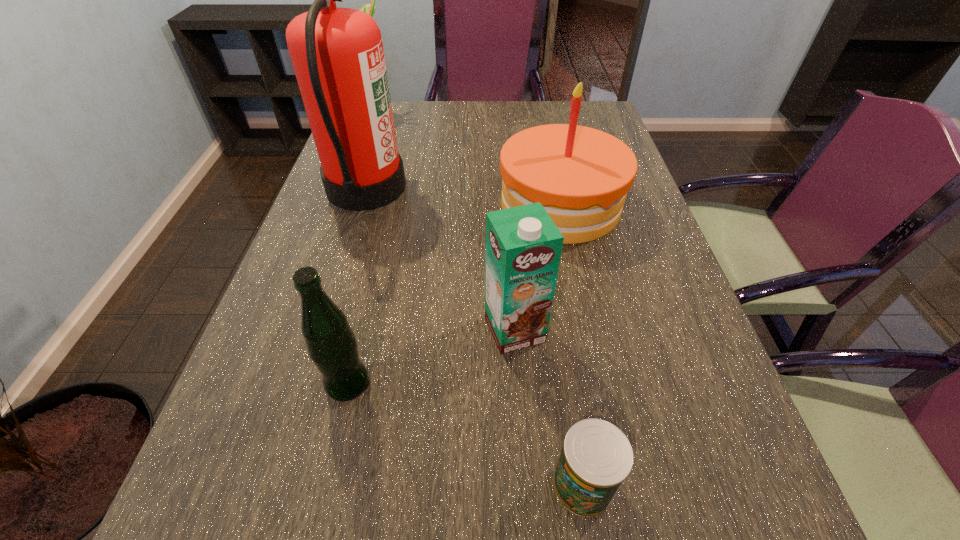
Locate an element on the screen. object that can be found as the fourth closest to the nearest object is located at coordinates (337, 54).

Find the location of a particular element. the fourth closest object relative to the tallest object is located at coordinates (332, 346).

What are the coordinates of `free space in the image that satisfies the following two spatial constraints: 1. on the back side of the birthday cake; 2. at the nozzle of the fire extinguisher` in the screenshot? It's located at (557, 186).

Where is `vacant space that satisfies the following two spatial constraints: 1. at the nozzle of the tallest object; 2. on the left side of the birthday cake`? The height and width of the screenshot is (540, 960). vacant space that satisfies the following two spatial constraints: 1. at the nozzle of the tallest object; 2. on the left side of the birthday cake is located at coordinates (361, 205).

Identify the location of free space in the image that satisfies the following two spatial constraints: 1. on the back side of the nearest object; 2. at the nozzle of the fire extinguisher. This screenshot has width=960, height=540. (537, 186).

What are the coordinates of `free space that satisfies the following two spatial constraints: 1. at the nozzle of the fire extinguisher; 2. on the right side of the shortest object` in the screenshot? It's located at (274, 485).

Locate an element on the screen. The image size is (960, 540). vacant space that satisfies the following two spatial constraints: 1. at the nozzle of the fire extinguisher; 2. on the back side of the fourth farthest object is located at coordinates (323, 329).

This screenshot has width=960, height=540. I want to click on vacant point that satisfies the following two spatial constraints: 1. on the back side of the beer bottle; 2. at the nozzle of the fire extinguisher, so click(394, 186).

The height and width of the screenshot is (540, 960). I want to click on vacant region that satisfies the following two spatial constraints: 1. on the front side of the can; 2. on the right side of the beer bottle, so (x=324, y=485).